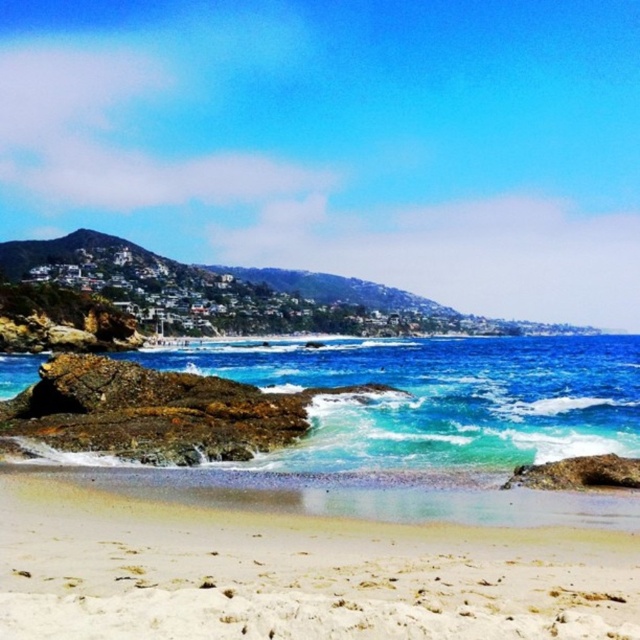
Question: Which point is farther to the camera?

Choices:
 (A) smooth beige sand at lower center
 (B) blue translucent water at center

Answer: (B)

Question: Is smooth beige sand at lower center above blue translucent water at center?

Choices:
 (A) yes
 (B) no

Answer: (B)

Question: Is smooth beige sand at lower center positioned in front of blue translucent water at center?

Choices:
 (A) no
 (B) yes

Answer: (B)

Question: Which object appears closest to the camera in this image?

Choices:
 (A) smooth beige sand at lower center
 (B) blue translucent water at center

Answer: (A)

Question: Among these points, which one is farthest from the camera?

Choices:
 (A) pyautogui.click(x=177, y=349)
 (B) pyautogui.click(x=429, y=620)

Answer: (A)

Question: Is smooth beige sand at lower center to the left of blue translucent water at center from the viewer's perspective?

Choices:
 (A) yes
 (B) no

Answer: (A)